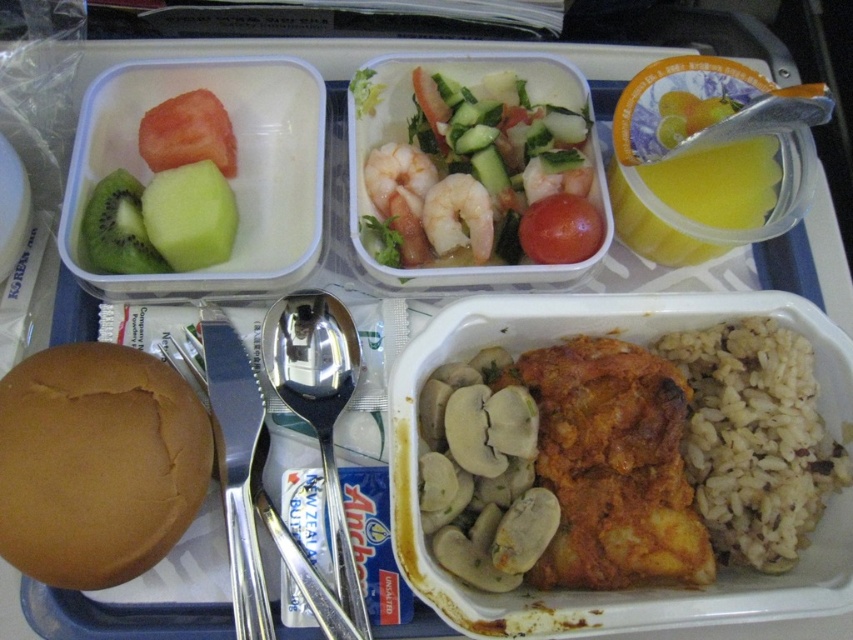
Question: Which of the following is the closest to the observer?

Choices:
 (A) (218, 211)
 (B) (515, 273)
 (C) (120, 204)

Answer: (C)

Question: Which point is closer to the camera?

Choices:
 (A) (99, 253)
 (B) (184, 195)
 (C) (717, 182)
 (D) (403, 68)

Answer: (A)

Question: Can you confirm if shiny orange shrimp at center is thinner than green matte kiwi at upper left?

Choices:
 (A) yes
 (B) no

Answer: (B)

Question: Does brown matte bun at lower left have a smaller size compared to yellow translucent cup at upper right?

Choices:
 (A) yes
 (B) no

Answer: (B)

Question: Which object is closer to the camera taking this photo?

Choices:
 (A) green matte kiwi at upper left
 (B) green matte apple at upper left
 (C) yellow translucent cup at upper right
 (D) brown matte rice at lower right

Answer: (D)

Question: Does shiny orange shrimp at center have a smaller size compared to yellow translucent cup at upper right?

Choices:
 (A) yes
 (B) no

Answer: (B)